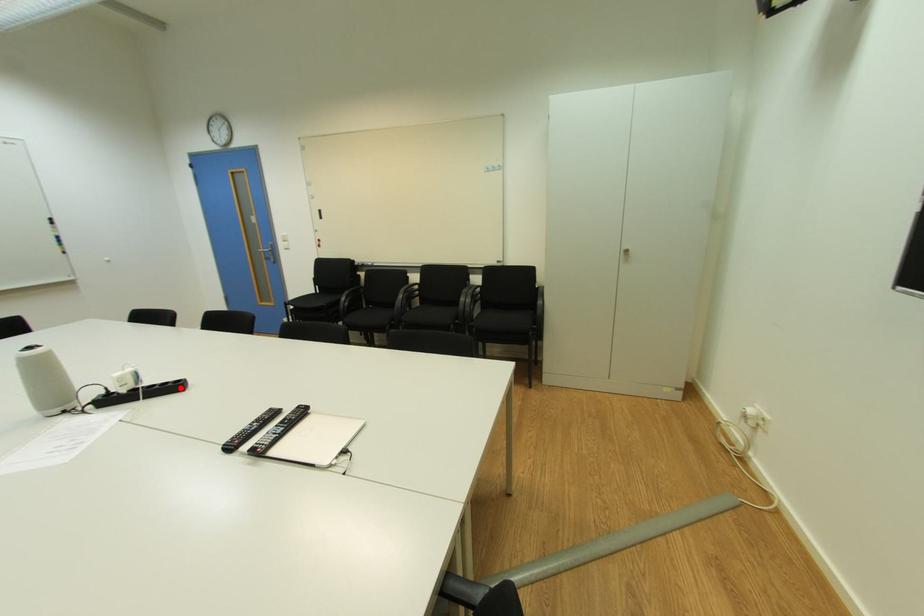
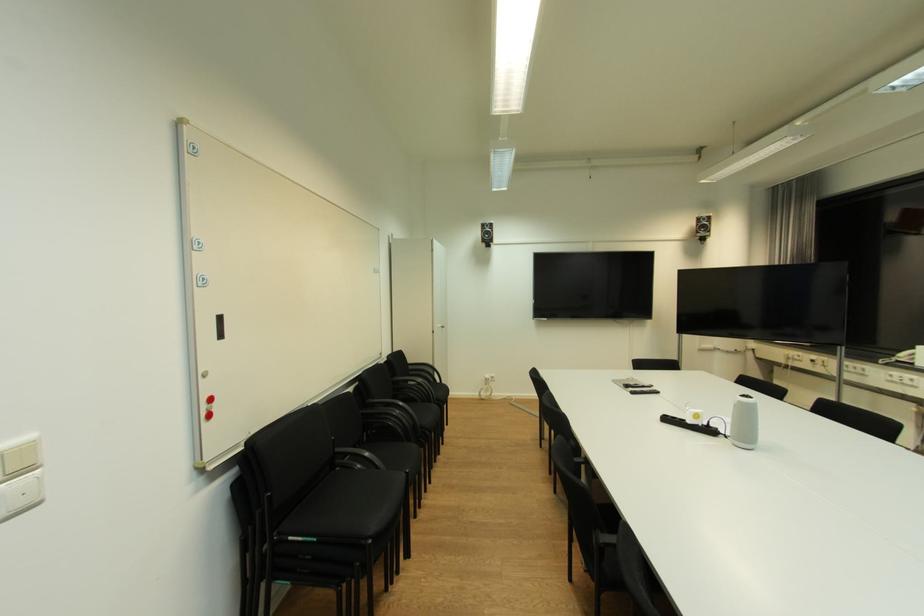
In the second image, find the point that corresponds to the highlighted location in the first image.

(674, 421)